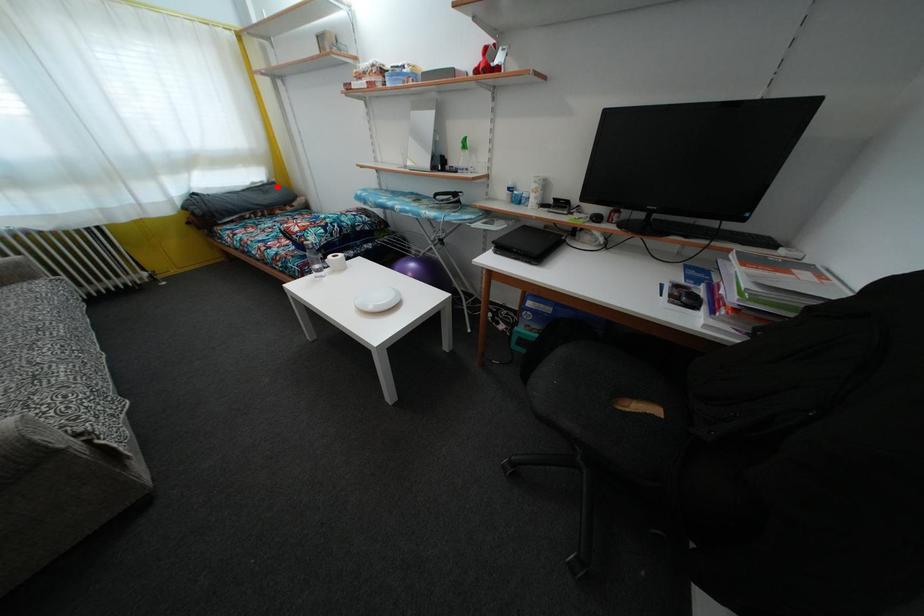
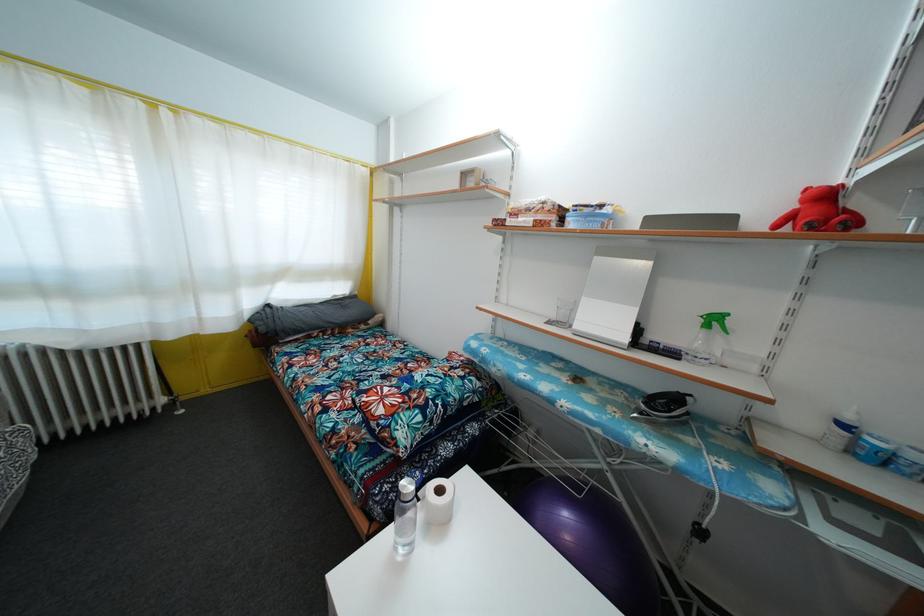
Question: I am providing you with two images of the same scene from different viewpoints. Given a red point in image1, look at the same physical point in image2. Is it:

Choices:
 (A) Closer to the viewpoint
 (B) Farther from the viewpoint

Answer: (B)